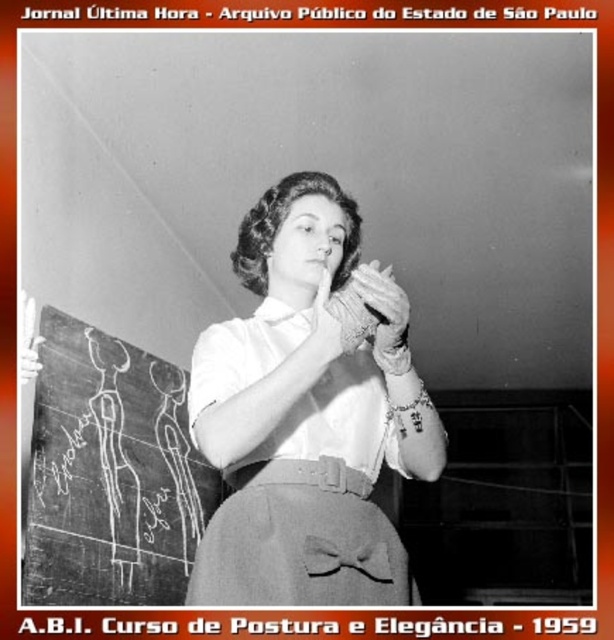
You are standing in the room shown in the image. There are two points marked in the scene. The first point is at coordinates point [371,596] and the second is at point [405,8]. Which point is closer to you?

Point [371,596] is closer to you because it is in front of point [405,8].

Please describe the location of the matte gray apron at center in the image using the coordinate system provided. The coordinates are given as a pair of values between 0 and 1, where 0 represents the leftmost and top edges, and 1 represents the rightmost and bottom edges of the image.

The matte gray apron at center is located at coordinate point 0.847 on the horizontal axis and 0.489 on the vertical axis.